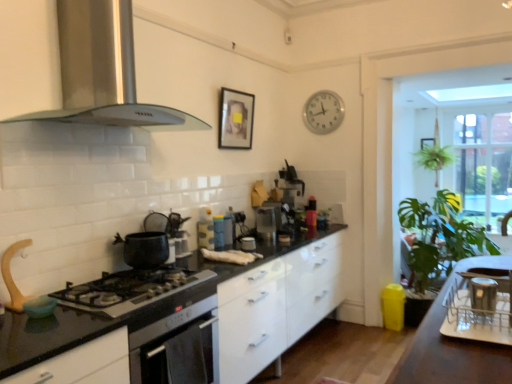
In order to click on unoccupied region to the right of matte blue thermos at center, the fourth appliance when ordered from front to back in this screenshot , I will do coord(240,240).